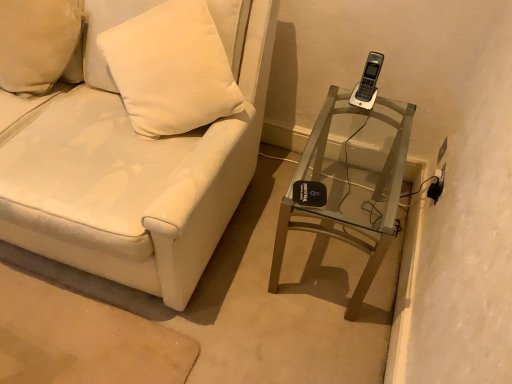
Question: Considering the relative sizes of clear glass table at right and white matte pillow at upper left in the image provided, is clear glass table at right thinner than white matte pillow at upper left?

Choices:
 (A) yes
 (B) no

Answer: (B)

Question: Is clear glass table at right at the left side of white matte pillow at upper left?

Choices:
 (A) yes
 (B) no

Answer: (B)

Question: Are clear glass table at right and white matte pillow at upper left far apart?

Choices:
 (A) no
 (B) yes

Answer: (B)

Question: Could you tell me if clear glass table at right is turned towards white matte pillow at upper left?

Choices:
 (A) yes
 (B) no

Answer: (B)

Question: Is clear glass table at right closer to camera compared to white matte pillow at upper left?

Choices:
 (A) no
 (B) yes

Answer: (B)

Question: Visually, is clear glass table at right positioned to the left or to the right of white leather couch at center?

Choices:
 (A) right
 (B) left

Answer: (A)

Question: From a real-world perspective, is clear glass table at right above or below white leather couch at center?

Choices:
 (A) below
 (B) above

Answer: (A)

Question: In terms of height, does clear glass table at right look taller or shorter compared to white leather couch at center?

Choices:
 (A) short
 (B) tall

Answer: (A)

Question: Is point (340, 235) positioned closer to the camera than point (76, 218)?

Choices:
 (A) farther
 (B) closer

Answer: (A)

Question: In terms of width, does white leather couch at center look wider or thinner when compared to clear glass table at right?

Choices:
 (A) wide
 (B) thin

Answer: (A)

Question: From the image's perspective, is white leather couch at center located above or below clear glass table at right?

Choices:
 (A) above
 (B) below

Answer: (A)

Question: Visually, is white leather couch at center positioned to the left or to the right of clear glass table at right?

Choices:
 (A) left
 (B) right

Answer: (A)

Question: Is point (144, 168) closer or farther from the camera than point (317, 150)?

Choices:
 (A) farther
 (B) closer

Answer: (B)

Question: In the image, is white matte pillow at upper left positioned in front of or behind clear glass table at right?

Choices:
 (A) behind
 (B) front

Answer: (A)

Question: From a real-world perspective, is white matte pillow at upper left physically located above or below clear glass table at right?

Choices:
 (A) above
 (B) below

Answer: (A)